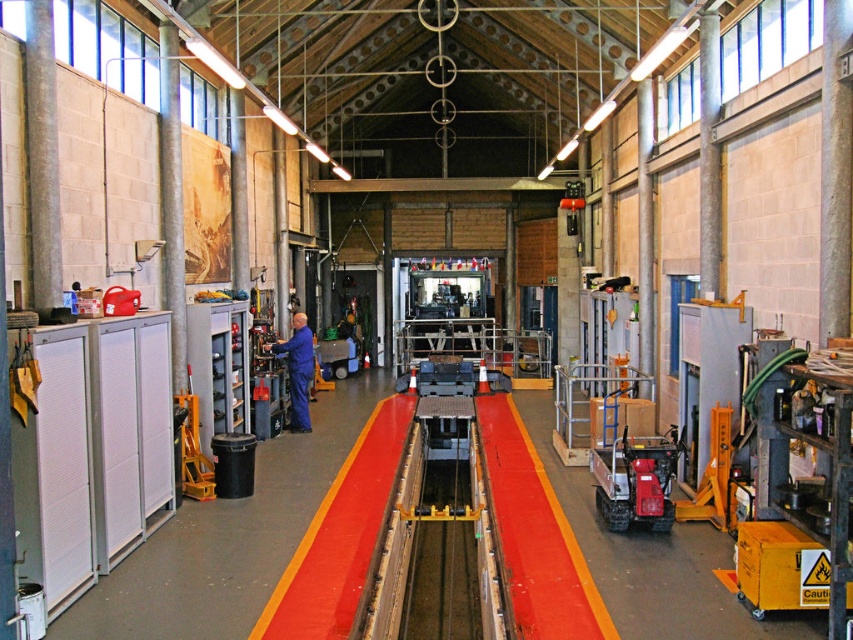
You are a maintenance worker in the workshop. You need to move a large equipment from the storage area to the loading dock. The equipment is as wide as the red plastic forklift at center. Can you safely transport it using the blue uniform at center as a reference for space? Please explain your reasoning.

The red plastic forklift at center is wider than the blue uniform at center. Since the equipment is as wide as the forklift, it may not fit through spaces that accommodate the blue uniform at center, so transportation might be risky without checking the exact dimensions.

In the scene shown: You are a maintenance worker in the blue uniform at center. You need to move a heavy box using the red plastic forklift at center. Can you safely operate the forklift while standing on the uniform?

The red plastic forklift at center is bigger than the blue uniform at center. Since the forklift is larger, you can safely operate it while standing on the uniform as there is enough space between them.